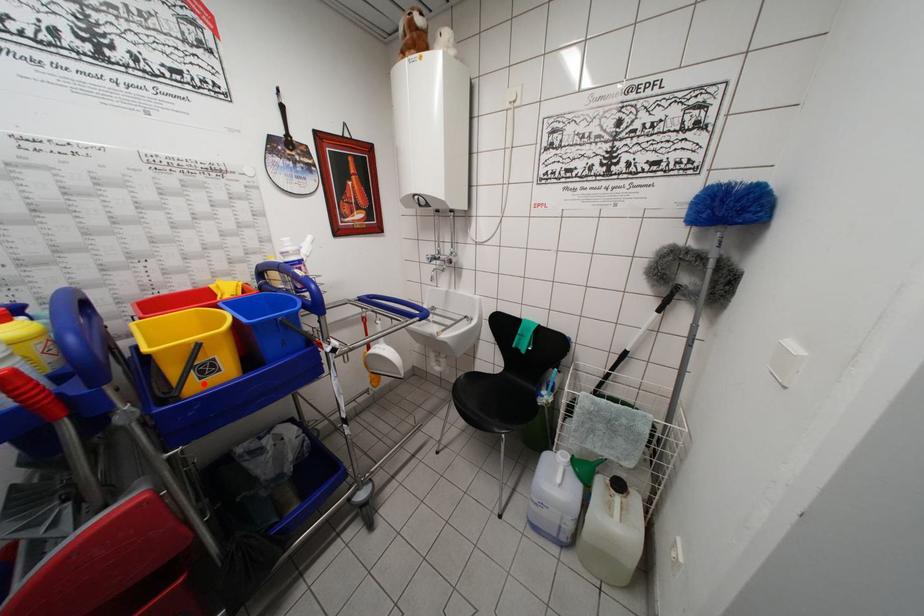
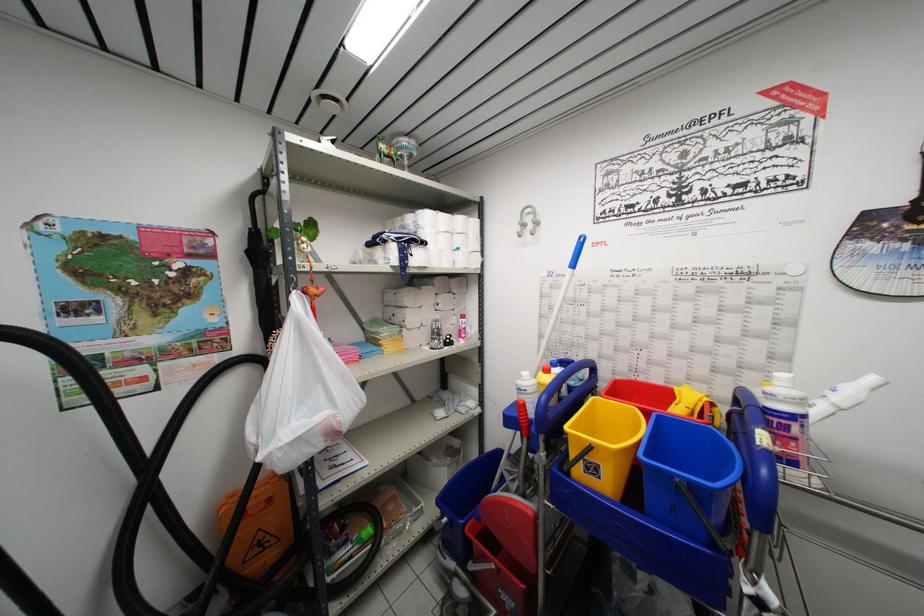
Where in the second image is the point corresponding to the highlighted location from the first image?

(589, 477)